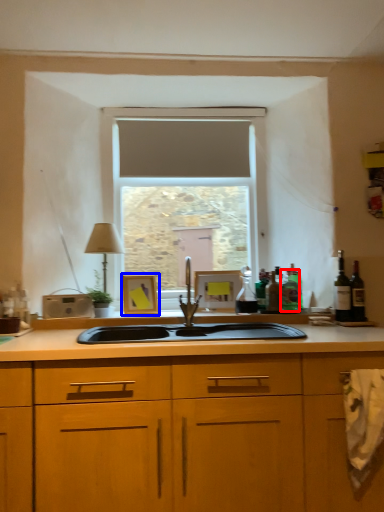
Question: Which of the following is the closest to the observer, bottle (highlighted by a red box) or picture frame (highlighted by a blue box)?

Choices:
 (A) bottle
 (B) picture frame

Answer: (A)